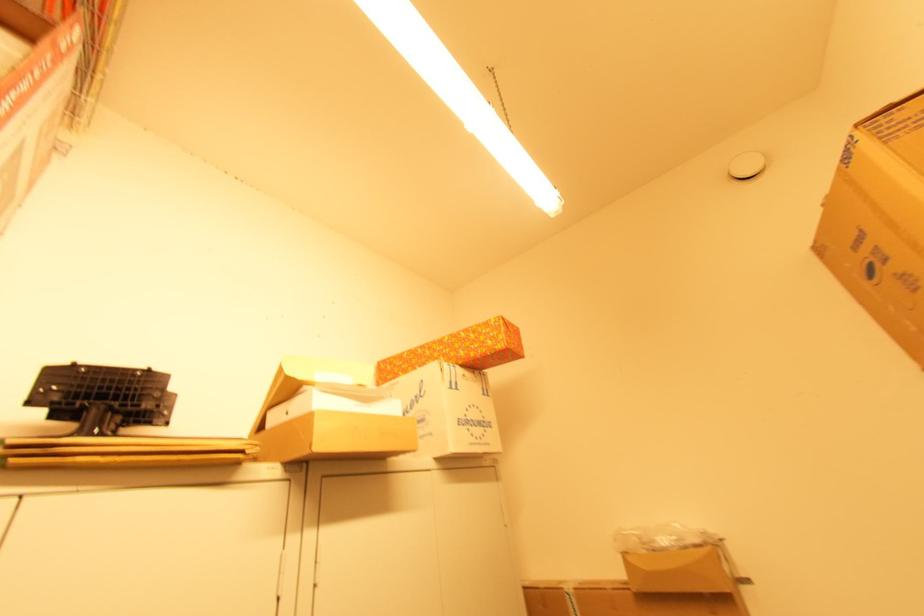
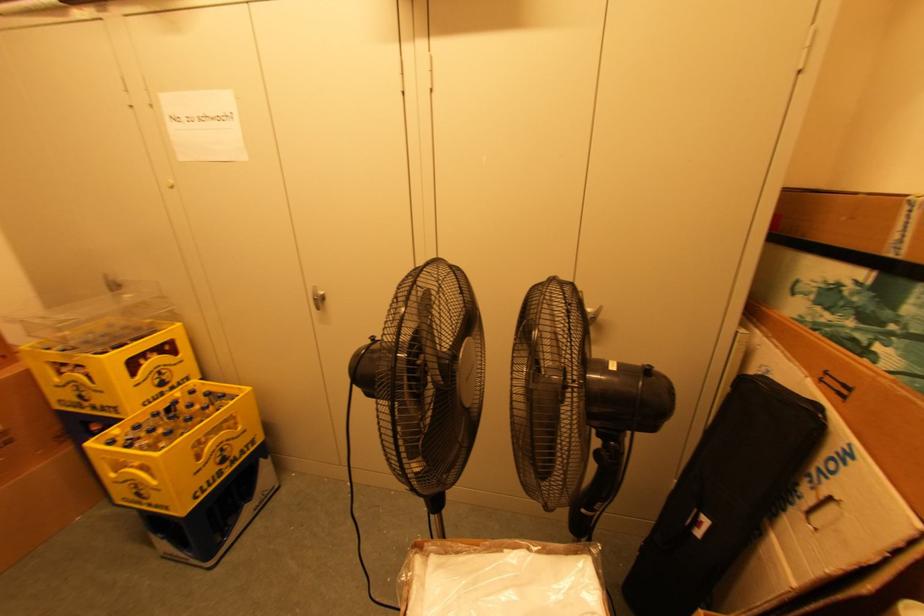
First-person continuous shooting, in which direction is the camera rotating?

The rotation direction of the camera is left-down.